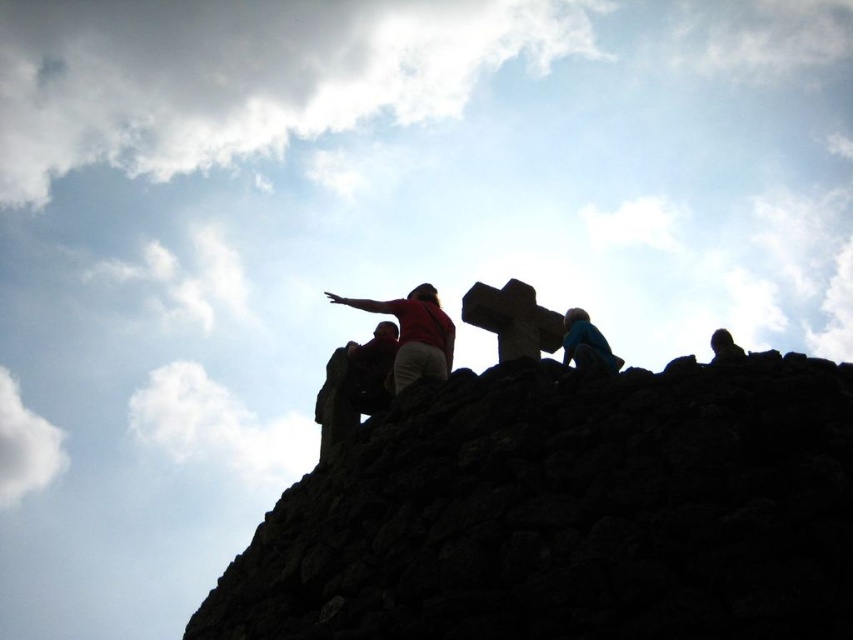
Between point (648, 627) and point (564, 356), which one is positioned in front?

Point (648, 627) is more forward.

Is point (788, 548) less distant than point (608, 362)?

Yes, it is.

Locate an element on the screen. The height and width of the screenshot is (640, 853). dark stone wall at upper center is located at coordinates (567, 513).

Does matte red shirt at center have a greater height compared to silhouette figure at upper right?

Indeed, matte red shirt at center has a greater height compared to silhouette figure at upper right.

Consider the image. Who is more distant from viewer, (329, 300) or (735, 352)?

Positioned behind is point (329, 300).

The image size is (853, 640). Describe the element at coordinates (413, 333) in the screenshot. I see `matte red shirt at center` at that location.

Where is `matte red shirt at center`? matte red shirt at center is located at coordinates (413, 333).

This screenshot has height=640, width=853. In order to click on matte red shirt at center in this screenshot , I will do `click(413, 333)`.

How distant is matte red shirt at center from blue fabric person at upper center?

11.25 meters

Describe the element at coordinates (413, 333) in the screenshot. The height and width of the screenshot is (640, 853). I see `matte red shirt at center` at that location.

In order to click on matte red shirt at center in this screenshot , I will do `click(413, 333)`.